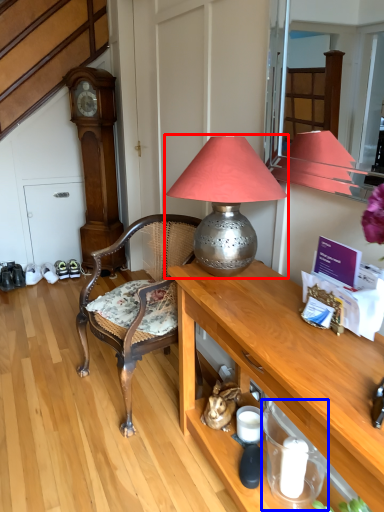
Question: Among these objects, which one is nearest to the camera, lamp (highlighted by a red box) or tableware (highlighted by a blue box)?

Choices:
 (A) lamp
 (B) tableware

Answer: (A)